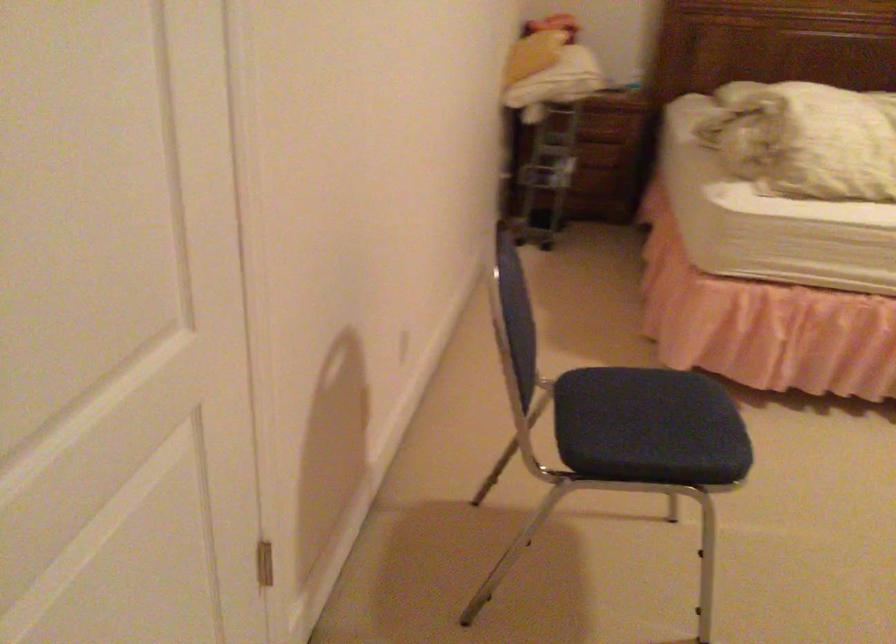
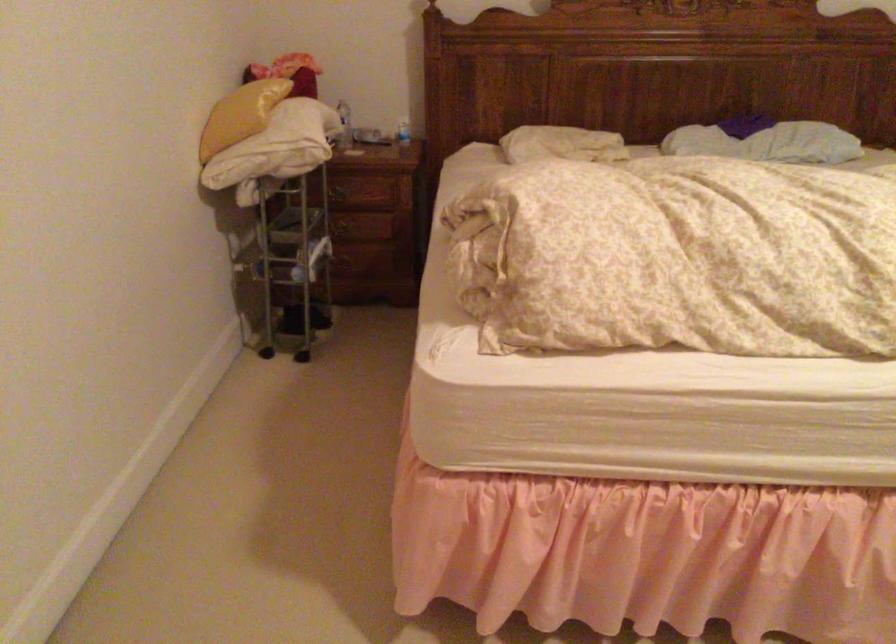
The point at [757,77] is marked in the first image. Where is the corresponding point in the second image?

(561, 144)